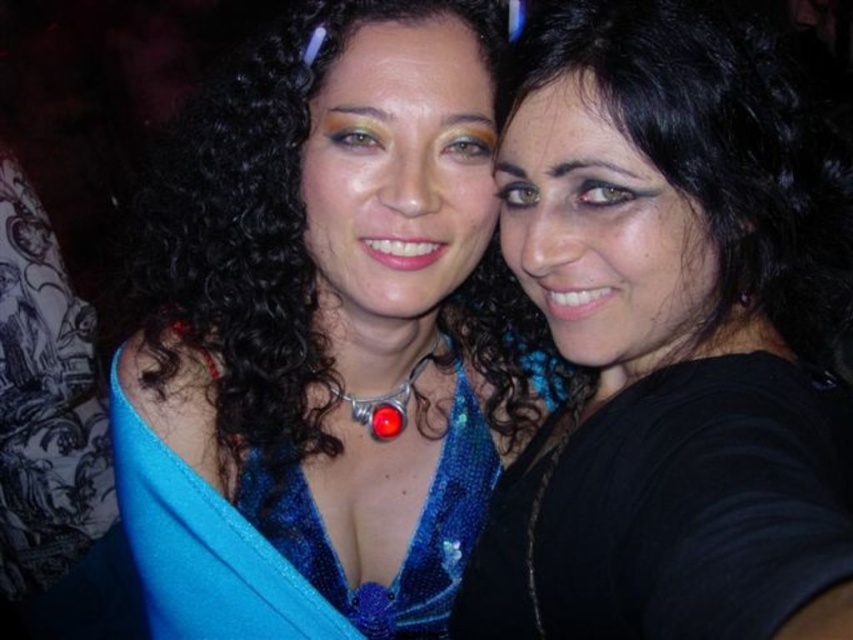
Which is below, black matte hair at center or shiny blue sequined dress at center?

shiny blue sequined dress at center

Locate an element on the screen. This screenshot has height=640, width=853. black matte hair at center is located at coordinates (670, 339).

Can you confirm if blue sequined dress at center is positioned to the right of shiny blue sequined dress at center?

Incorrect, blue sequined dress at center is not on the right side of shiny blue sequined dress at center.

Does blue sequined dress at center lie behind shiny blue sequined dress at center?

No.

Which is in front, point (276, 465) or point (223, 573)?

Positioned in front is point (223, 573).

The height and width of the screenshot is (640, 853). What are the coordinates of `blue sequined dress at center` in the screenshot? It's located at (332, 316).

Is blue sequined dress at center smaller than black matte hair at center?

No.

Is point (148, 221) positioned behind point (686, 81)?

Yes, point (148, 221) is behind point (686, 81).

Is point (413, 604) farther from viewer compared to point (737, 269)?

That is True.

Identify the location of blue sequined dress at center. The image size is (853, 640). (332, 316).